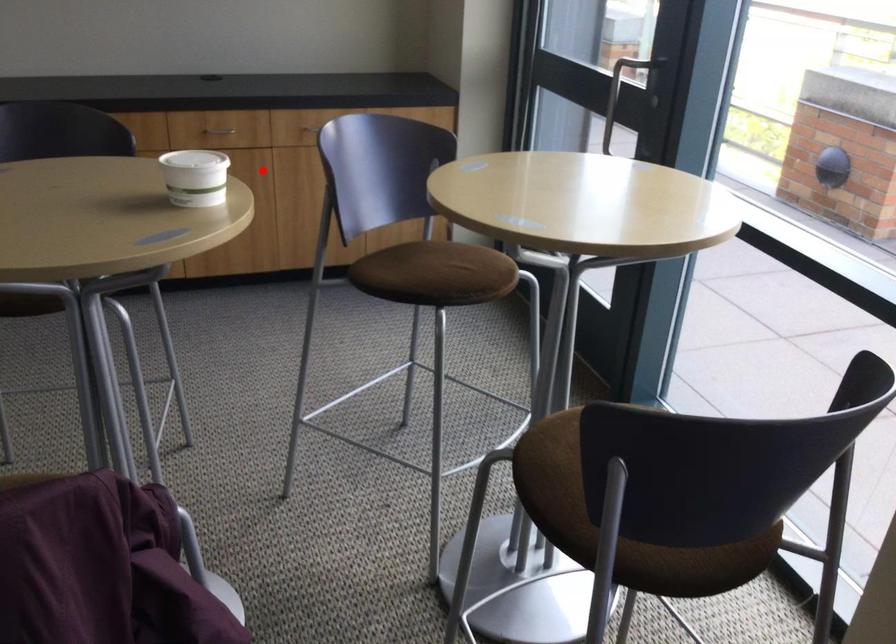
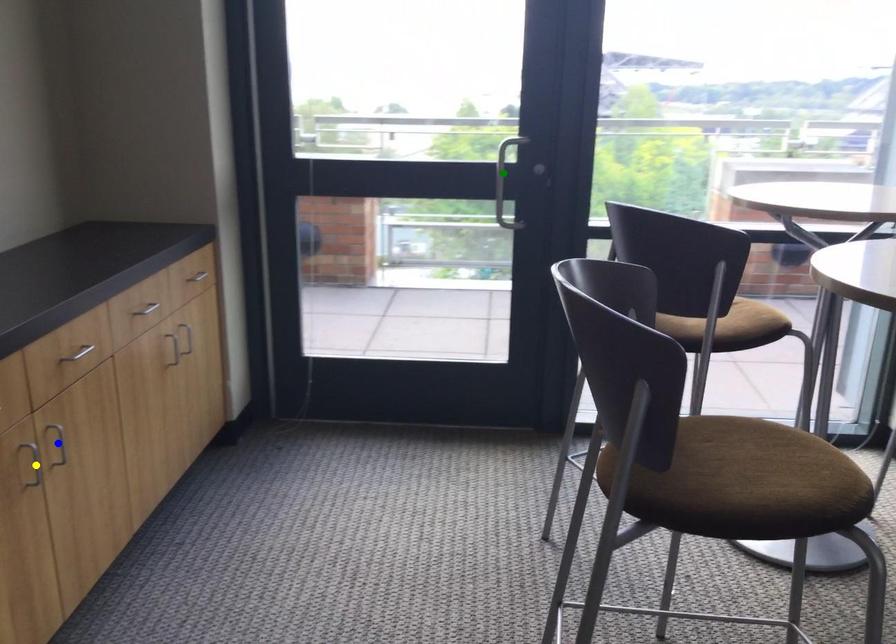
Question: I am providing you with two images of the same scene from different viewpoints. A red point is marked on the first image. You are given multiple points on the second image. In image 2, which mark is for the same physical point as the one in image 1?

Choices:
 (A) blue point
 (B) yellow point
 (C) green point

Answer: (A)